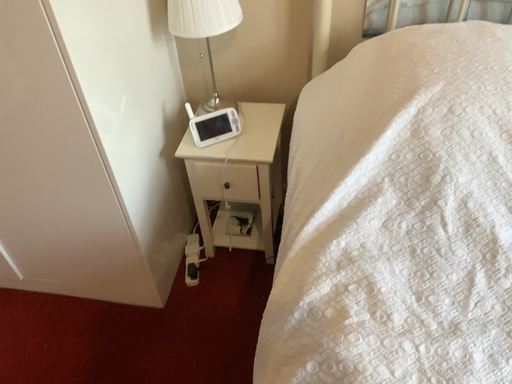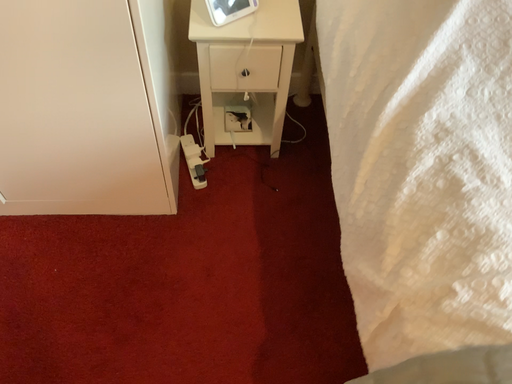
Question: How did the camera likely rotate when shooting the video?

Choices:
 (A) rotated upward
 (B) rotated downward

Answer: (B)